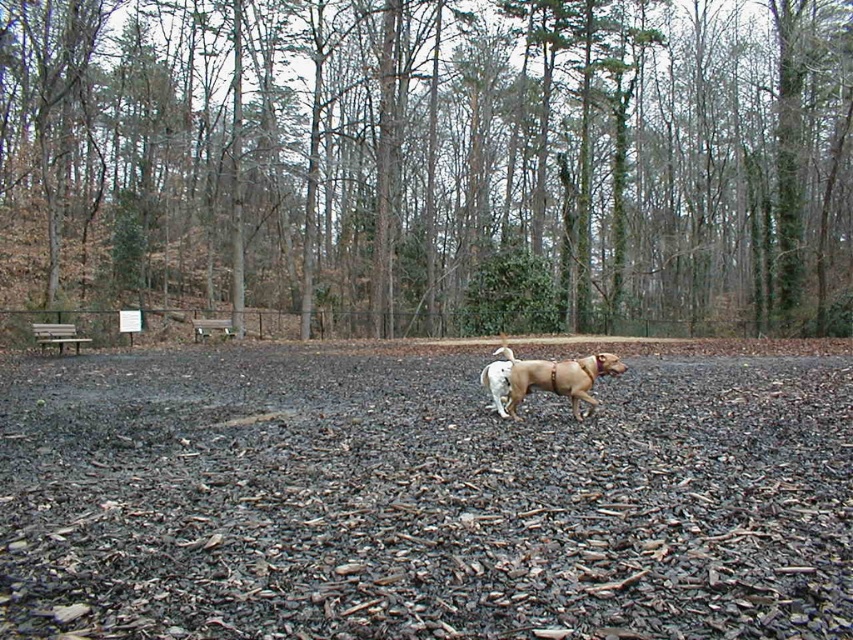
You are a park visitor who wants to sit on the wooden bench at left and the brown wooden bench at center. Since you can only choose one, which bench would be higher up from the ground?

The brown wooden bench at center is higher up from the ground because the wooden bench at left is located below it.

You are standing in the park and want to take a photo of both point markers. Which point marker, point [569,371] or point [200,332], should you focus on first to ensure both are in clear view?

Point [569,371] is closer to the camera than point [200,332]. To ensure both are in clear view, focus on the closer point first, which is point [569,371].